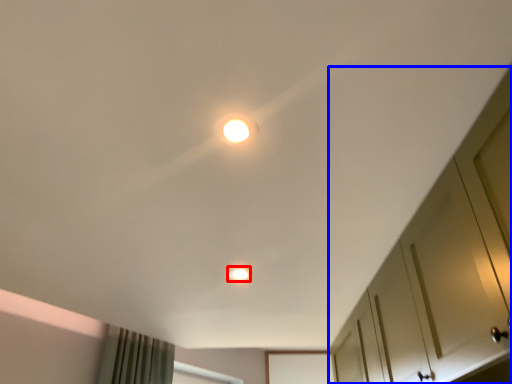
Question: Which object is further to the camera taking this photo, dot (highlighted by a red box) or dresser (highlighted by a blue box)?

Choices:
 (A) dot
 (B) dresser

Answer: (A)